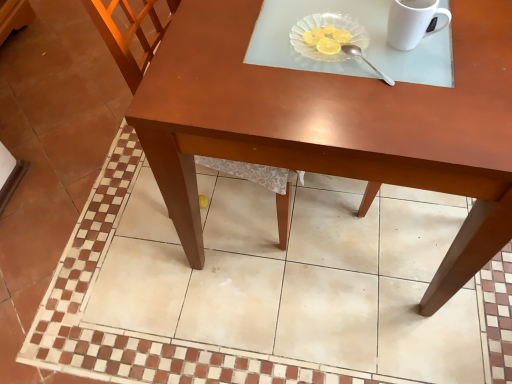
Locate an element on the screen. This screenshot has width=512, height=384. space that is in front of silver metallic spoon at upper center is located at coordinates (382, 115).